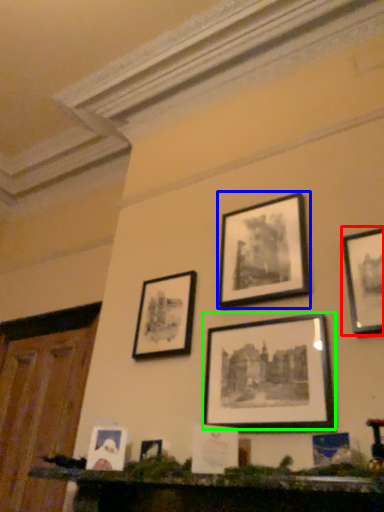
Question: Considering the real-world distances, which object is closest to picture frame (highlighted by a red box)? picture frame (highlighted by a blue box) or picture frame (highlighted by a green box).

Choices:
 (A) picture frame
 (B) picture frame

Answer: (B)